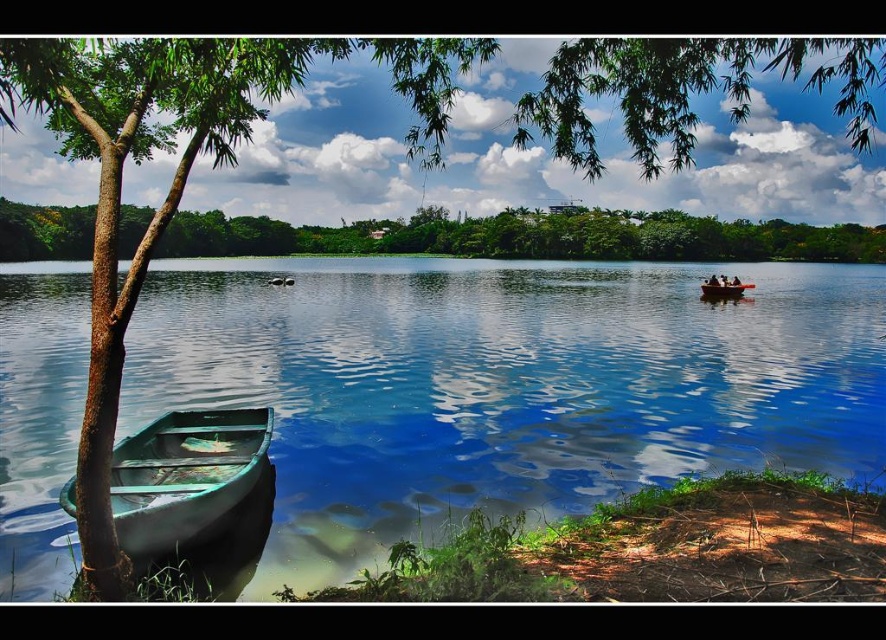
Question: Observing the image, what is the correct spatial positioning of green leafy tree at upper center in reference to green wooden boat at lower left?

Choices:
 (A) above
 (B) below

Answer: (A)

Question: Does green matte boat at lower left appear on the left side of wooden boat at center?

Choices:
 (A) no
 (B) yes

Answer: (B)

Question: Estimate the real-world distances between objects in this image. Which object is farther from the green wooden boat at lower left?

Choices:
 (A) wooden boat at center
 (B) green matte boat at lower left

Answer: (A)

Question: Which point appears farthest from the camera in this image?

Choices:
 (A) (734, 296)
 (B) (181, 410)
 (C) (55, 221)
 (D) (316, 438)

Answer: (C)

Question: Does green leafy tree at upper center have a larger size compared to green wooden boat at lower left?

Choices:
 (A) no
 (B) yes

Answer: (B)

Question: Among these points, which one is farthest from the camera?

Choices:
 (A) (736, 288)
 (B) (121, 444)
 (C) (791, 380)
 (D) (696, 256)

Answer: (D)